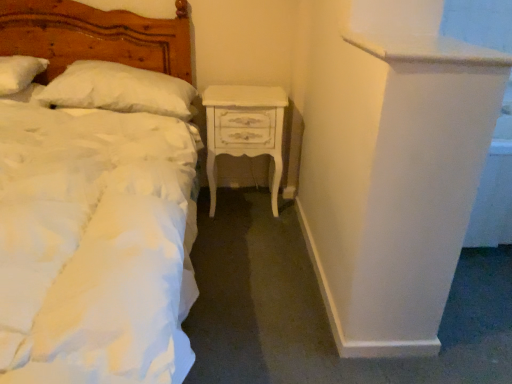
Question: Should I look upward or downward to see white fluffy pillow at upper left, which is the 1th pillow in right-to-left order?

Choices:
 (A) up
 (B) down

Answer: (A)

Question: Does white fluffy pillow at upper left, which is the 1th pillow in right-to-left order, lie behind white soft pillow at upper left, the 1th pillow from the left?

Choices:
 (A) yes
 (B) no

Answer: (A)

Question: Does white fluffy pillow at upper left, which is the 1th pillow in right-to-left order, have a larger size compared to white soft pillow at upper left, the 1th pillow from the left?

Choices:
 (A) no
 (B) yes

Answer: (B)

Question: Can you confirm if white fluffy pillow at upper left, the second pillow from the left, is wider than white soft pillow at upper left, acting as the second pillow starting from the right?

Choices:
 (A) no
 (B) yes

Answer: (B)

Question: Could you tell me if white fluffy pillow at upper left, the second pillow from the left, is turned towards white soft pillow at upper left, the 1th pillow from the left?

Choices:
 (A) no
 (B) yes

Answer: (A)

Question: Is white soft pillow at upper left, acting as the second pillow starting from the right, surrounded by white fluffy pillow at upper left, the second pillow from the left?

Choices:
 (A) yes
 (B) no

Answer: (B)

Question: Can you confirm if white fluffy pillow at upper left, the second pillow from the left, is positioned to the right of white soft pillow at upper left, the 1th pillow from the left?

Choices:
 (A) yes
 (B) no

Answer: (A)

Question: Is white fluffy pillow at upper left, which is the 1th pillow in right-to-left order, at the right side of white painted wood nightstand at center?

Choices:
 (A) yes
 (B) no

Answer: (B)

Question: Does white fluffy pillow at upper left, which is the 1th pillow in right-to-left order, come in front of white painted wood nightstand at center?

Choices:
 (A) yes
 (B) no

Answer: (A)

Question: Can you confirm if white fluffy pillow at upper left, which is the 1th pillow in right-to-left order, is thinner than white painted wood nightstand at center?

Choices:
 (A) no
 (B) yes

Answer: (A)

Question: Can you confirm if white fluffy pillow at upper left, which is the 1th pillow in right-to-left order, is wider than white painted wood nightstand at center?

Choices:
 (A) yes
 (B) no

Answer: (A)

Question: Does white fluffy pillow at upper left, which is the 1th pillow in right-to-left order, have a lesser height compared to white painted wood nightstand at center?

Choices:
 (A) no
 (B) yes

Answer: (B)

Question: Are white fluffy pillow at upper left, which is the 1th pillow in right-to-left order, and white painted wood nightstand at center making contact?

Choices:
 (A) no
 (B) yes

Answer: (A)

Question: Is white soft pillow at upper left, acting as the second pillow starting from the right, not within white fluffy pillow at upper left, which is the 1th pillow in right-to-left order?

Choices:
 (A) yes
 (B) no

Answer: (A)